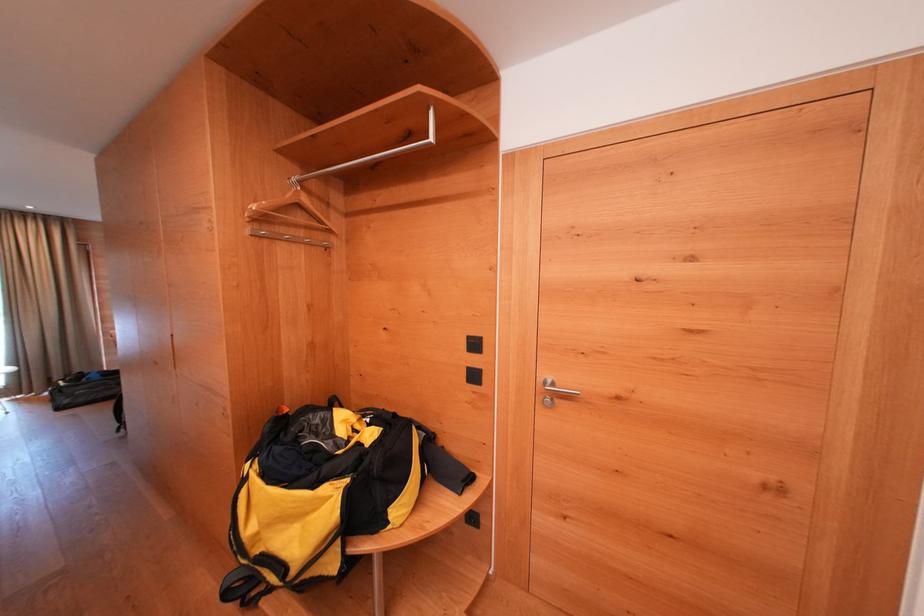
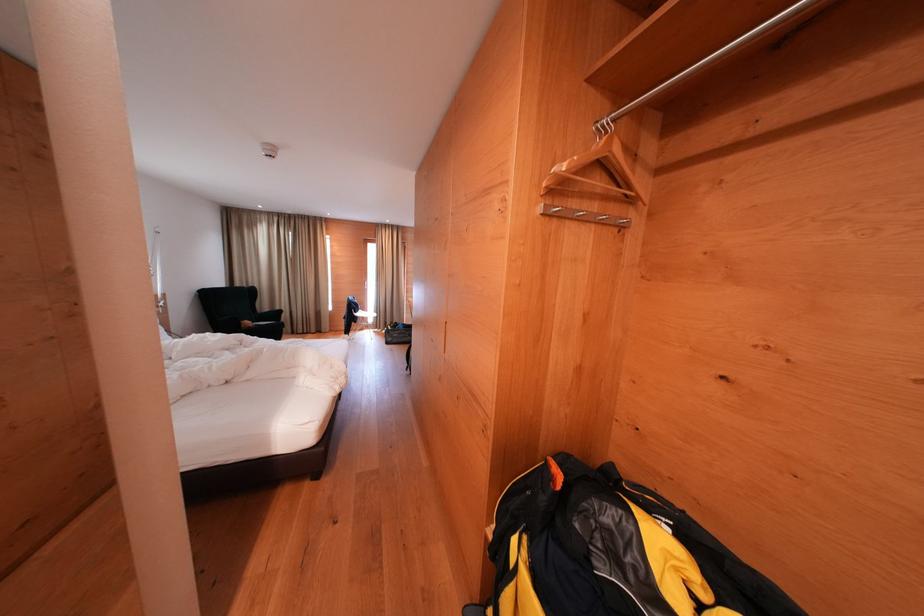
The point at (254, 236) is marked in the first image. Where is the corresponding point in the second image?

(546, 213)